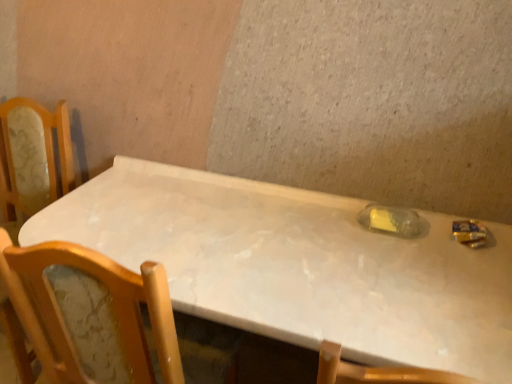
At what (x,y) coordinates should I click in order to perform the action: click on translucent plastic bottle at center. Please return your answer as a coordinate pair (x, y). The image size is (512, 384). Looking at the image, I should click on (391, 220).

The image size is (512, 384). What do you see at coordinates (391, 220) in the screenshot?
I see `translucent plastic bottle at center` at bounding box center [391, 220].

What do you see at coordinates (298, 266) in the screenshot? I see `white marble table at center` at bounding box center [298, 266].

The height and width of the screenshot is (384, 512). In order to click on white marble table at center in this screenshot , I will do `click(298, 266)`.

This screenshot has width=512, height=384. In order to click on translucent plastic bottle at center in this screenshot , I will do `click(391, 220)`.

Considering the positions of objects translucent plastic bottle at center and white marble table at center in the image provided, who is more to the left, translucent plastic bottle at center or white marble table at center?

Positioned to the left is white marble table at center.

Which object is further away from the camera taking this photo, translucent plastic bottle at center or white marble table at center?

translucent plastic bottle at center is more distant.

Which point is more distant from viewer, (418, 227) or (216, 193)?

Point (216, 193)

From the image's perspective, which is below, translucent plastic bottle at center or white marble table at center?

white marble table at center is shown below in the image.

From a real-world perspective, who is located higher, translucent plastic bottle at center or white marble table at center?

translucent plastic bottle at center is physically above.

Which object is thinner, translucent plastic bottle at center or white marble table at center?

translucent plastic bottle at center.

Which of these two, translucent plastic bottle at center or white marble table at center, stands shorter?

translucent plastic bottle at center.

Who is bigger, translucent plastic bottle at center or white marble table at center?

white marble table at center.

Is white marble table at center a part of translucent plastic bottle at center?

That's incorrect, white marble table at center is not inside translucent plastic bottle at center.

Is translucent plastic bottle at center far from white marble table at center?

Actually, translucent plastic bottle at center and white marble table at center are a little close together.

Is translucent plastic bottle at center oriented away from white marble table at center?

Yes, translucent plastic bottle at center is positioned with its back facing white marble table at center.

What's the angular difference between translucent plastic bottle at center and white marble table at center's facing directions?

The angle between the facing direction of translucent plastic bottle at center and the facing direction of white marble table at center is 2.32 degrees.

How far apart are translucent plastic bottle at center and white marble table at center?

translucent plastic bottle at center and white marble table at center are 15.39 inches apart from each other.

Identify the location of table below the translucent plastic bottle at center (from the image's perspective). The image size is (512, 384). (298, 266).

Does white marble table at center appear on the right side of translucent plastic bottle at center?

No.

In the scene shown: Is the position of white marble table at center more distant than that of translucent plastic bottle at center?

No, white marble table at center is in front of translucent plastic bottle at center.

Which is in front, point (245, 329) or point (377, 228)?

Positioned in front is point (245, 329).

From the image's perspective, between white marble table at center and translucent plastic bottle at center, which one is located above?

translucent plastic bottle at center, from the image's perspective.

From a real-world perspective, is white marble table at center physically located above or below translucent plastic bottle at center?

Clearly, from a real-world perspective, white marble table at center is below translucent plastic bottle at center.

Can you confirm if white marble table at center is wider than translucent plastic bottle at center?

Indeed, white marble table at center has a greater width compared to translucent plastic bottle at center.

Does white marble table at center have a lesser height compared to translucent plastic bottle at center?

No.

Looking at this image, who is bigger, white marble table at center or translucent plastic bottle at center?

Bigger between the two is white marble table at center.

Could translucent plastic bottle at center be considered to be inside white marble table at center?

Yes, translucent plastic bottle at center is a part of white marble table at center.

Is white marble table at center far from translucent plastic bottle at center?

No, white marble table at center is not far away from translucent plastic bottle at center.

Is white marble table at center oriented away from translucent plastic bottle at center?

white marble table at center does not have its back to translucent plastic bottle at center.

What's the angular difference between white marble table at center and translucent plastic bottle at center's facing directions?

white marble table at center and translucent plastic bottle at center are facing 2.32 degrees away from each other.

The width and height of the screenshot is (512, 384). In order to click on bottle behind the white marble table at center in this screenshot , I will do `click(391, 220)`.

Where is `bottle to the right of white marble table at center`? The height and width of the screenshot is (384, 512). bottle to the right of white marble table at center is located at coordinates pyautogui.click(x=391, y=220).

I want to click on bottle above the white marble table at center (from a real-world perspective), so click(391, 220).